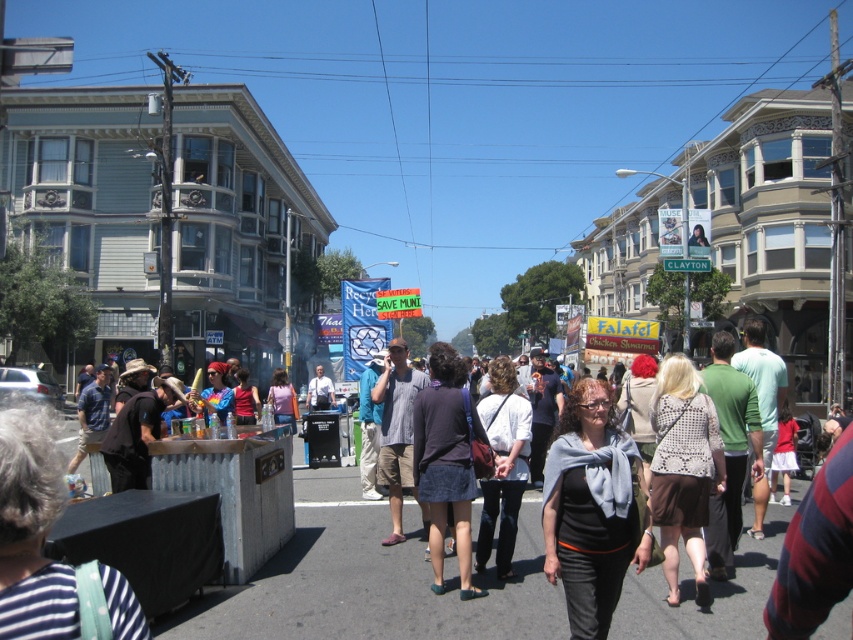
You are a photographer standing in the middle of the street. You see a black cotton shirt at center and a dark blue denim skirt at center. Which one is positioned to the right of the other?

The black cotton shirt at center is to the right of the dark blue denim skirt at center.

You are a photographer standing on the street and want to capture both the black cotton shirt at center and the gray scarf at center in the same photo. Which object should you position closer to the left side of your camera frame to include both?

To include both the black cotton shirt at center and the gray scarf at center in the same photo, you should position the gray scarf at center closer to the left side of your camera frame since the black cotton shirt at center is to the right of the gray scarf at center.